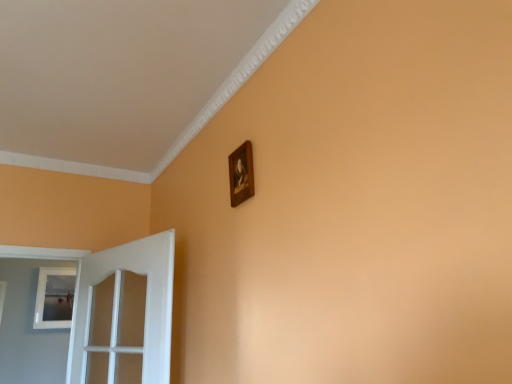
Question: In terms of size, does white glossy door at left appear bigger or smaller than wooden frame at upper center, which is counted as the 1th picture frame, starting from the front?

Choices:
 (A) big
 (B) small

Answer: (A)

Question: Looking at their shapes, would you say white glossy door at left is wider or thinner than wooden frame at upper center, which is counted as the 1th picture frame, starting from the front?

Choices:
 (A) wide
 (B) thin

Answer: (A)

Question: Which object is the closest to the wooden frame at upper center, which is counted as the 1th picture frame, starting from the front?

Choices:
 (A) white glossy door at left
 (B) white matte picture frame at left, which is counted as the first picture frame, starting from the back

Answer: (A)

Question: Which object is positioned closest to the white glossy door at left?

Choices:
 (A) white matte picture frame at left, which ranks as the 1th picture frame in left-to-right order
 (B) wooden frame at upper center, which is counted as the 1th picture frame, starting from the front

Answer: (B)